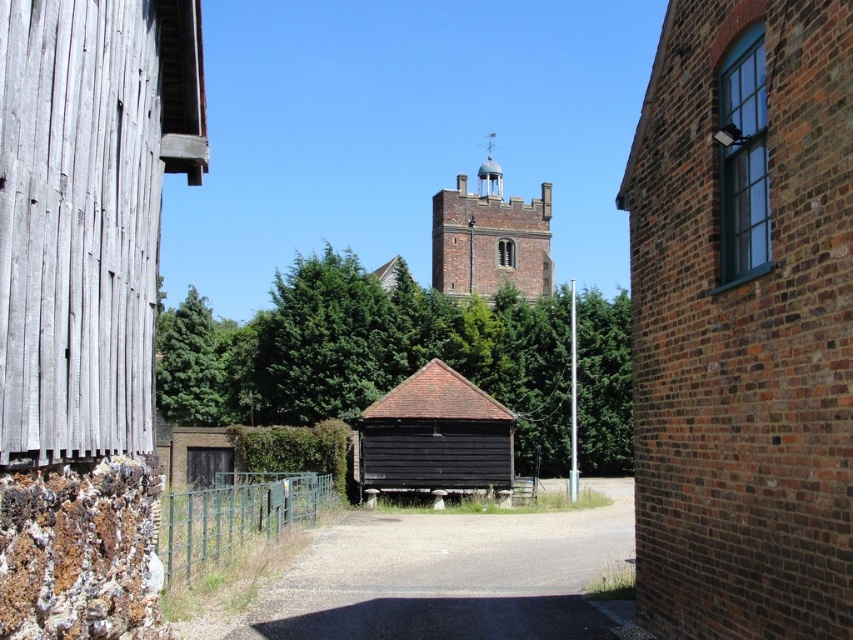
You are standing in the middle of a rural area and see the green leafy tree at center and the green wire fence at center. Which object is higher from the ground?

The green leafy tree at center is above the green wire fence at center, so the green leafy tree at center is higher from the ground.

You are a delivery drone carrying a package that requires a landing zone at least 15 meters wide. You have to land between the brick wall at right and the dark brown wooden barn at center. Is the space between them wide enough for your landing?

The distance between the brick wall at right and the dark brown wooden barn at center is 16.91 meters, which is wider than the required 15 meters. Therefore, the space is wide enough for the drone to land safely.

Looking at this image, you are a painter who wants to paint both the brick wall at right and the dark brown wooden barn at center. Since you can only carry enough paint for one large object, which object should you choose to paint first based on their sizes?

The brick wall at right has a larger size compared to the dark brown wooden barn at center, so you should paint the brick wall at right first as it requires more paint.